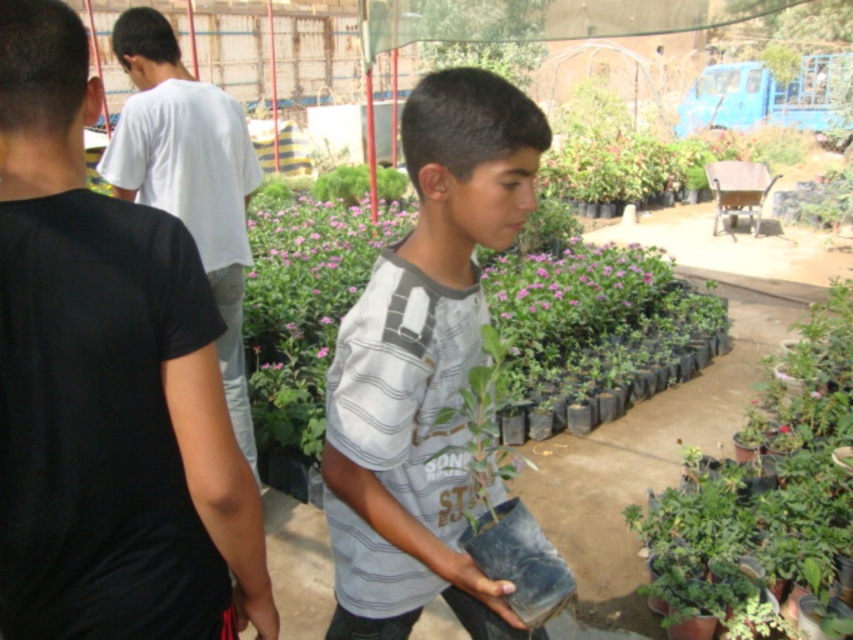
You are a gardener who needs to water the pink matte flowers at center. You are currently standing next to the gray striped shirt at center. Can you reach the flowers without moving from your current position if your watering hose is 3 meters long?

The distance between gray striped shirt at center and pink matte flowers at center is 3.50 meters, so the 3 meter hose is too short to reach the flowers without moving.

You are standing at the point labeled point (143, 609) and want to walk towards the point labeled point (320, 346). Will you pass in front of or behind the boy holding the small potted plant?

Since point (143, 609) is in front of point (320, 346), you will pass in front of the boy holding the small potted plant.

Looking at this image, you are standing in the nursery scene. You see a point marked at coordinate (106, 387). What object is located at that point?

The point at coordinate (106, 387) corresponds to the black cotton shirt at center.